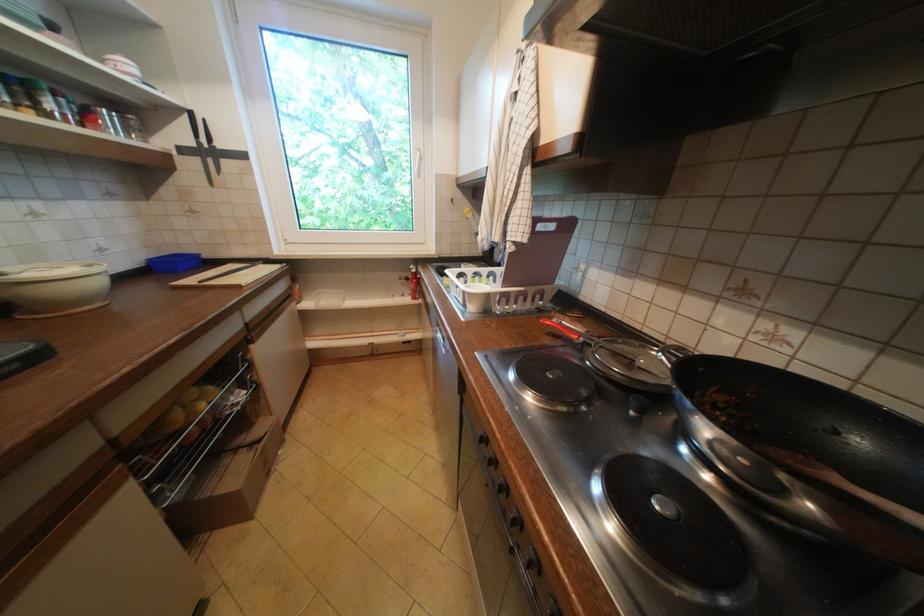
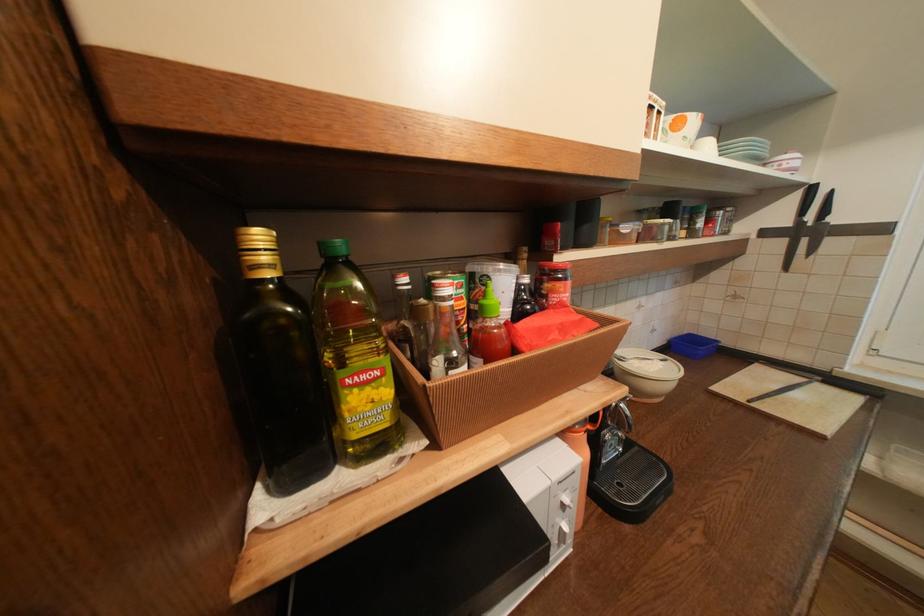
The point at (92, 270) is marked in the first image. Where is the corresponding point in the second image?

(670, 363)